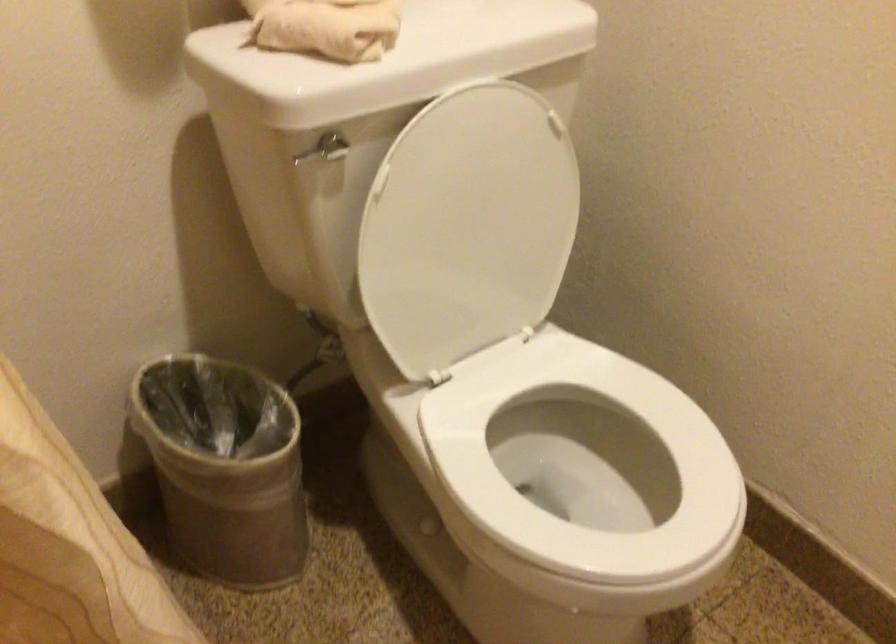
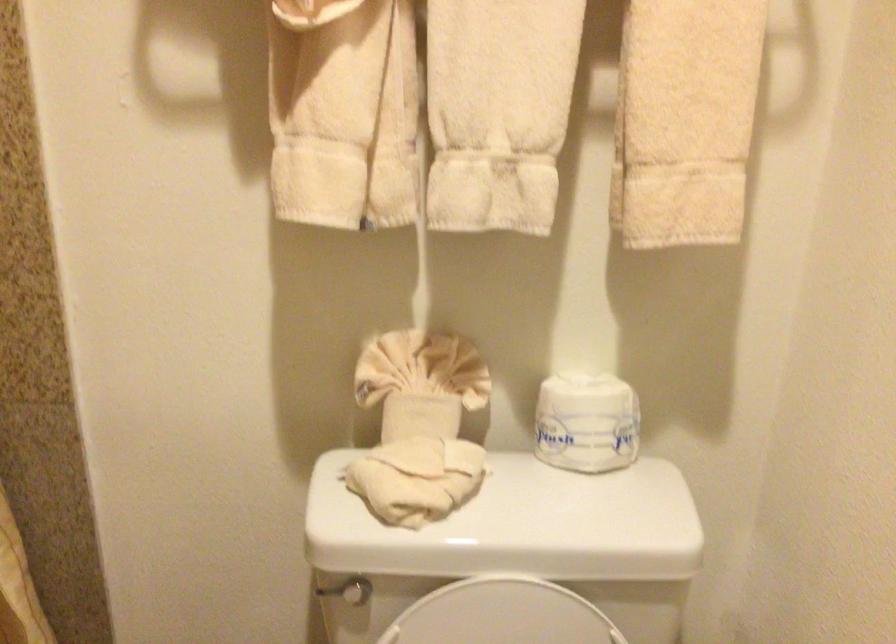
The point at (295, 156) is marked in the first image. Where is the corresponding point in the second image?

(326, 590)